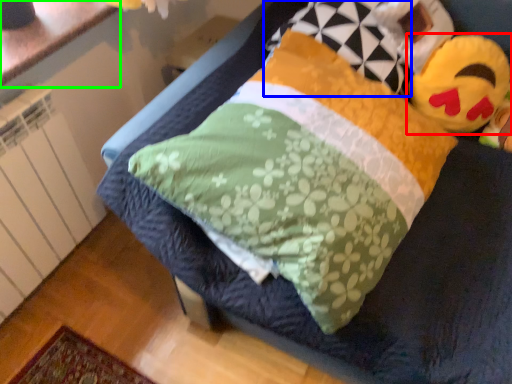
Question: Based on their relative distances, which object is nearer to toy (highlighted by a red box)? Choose from pillow (highlighted by a blue box) and counter top (highlighted by a green box).

Choices:
 (A) pillow
 (B) counter top

Answer: (A)